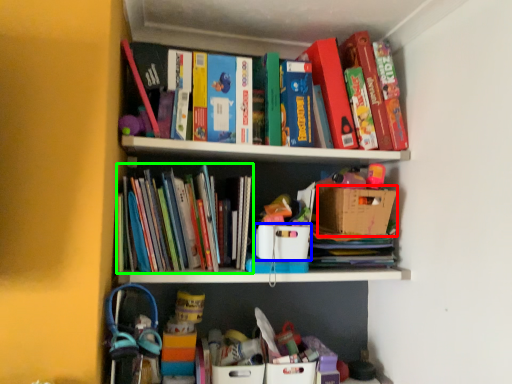
Question: Which is nearer to the cardboard box (highlighted by a red box)? cardboard box (highlighted by a blue box) or book (highlighted by a green box).

Choices:
 (A) cardboard box
 (B) book

Answer: (A)